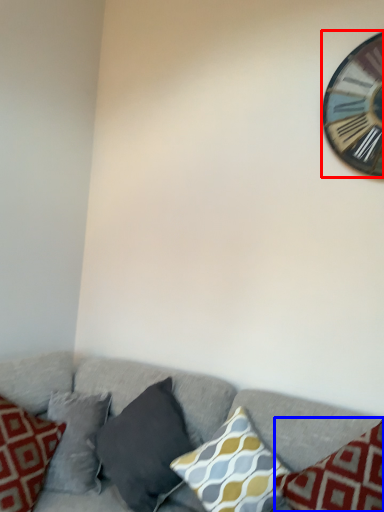
Question: Which of the following is the closest to the observer, wall clock (highlighted by a red box) or pillow (highlighted by a blue box)?

Choices:
 (A) wall clock
 (B) pillow

Answer: (B)